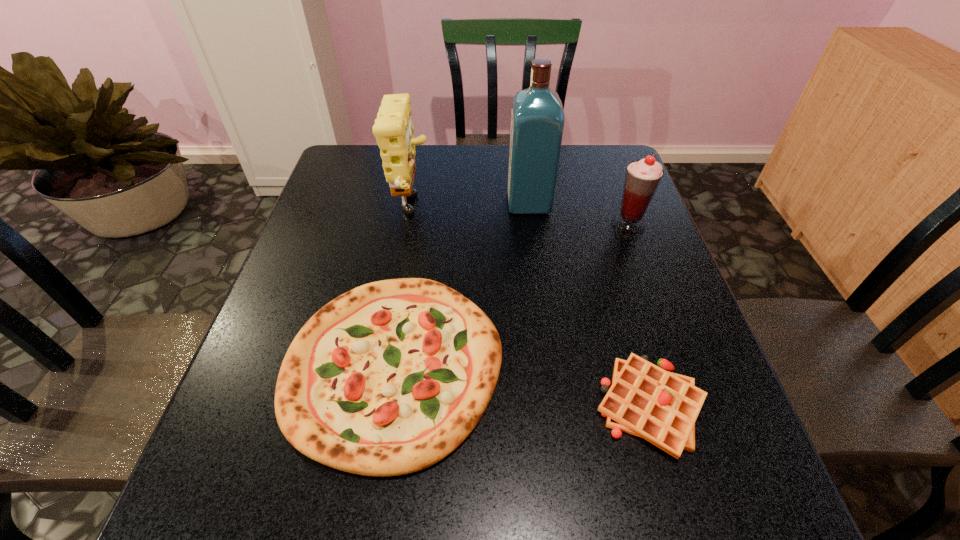
Locate an element on the screen. vacant space located 0.330m on the front of the third shortest object is located at coordinates point(671,341).

The image size is (960, 540). I want to click on vacant space located 0.060m on the left of the pizza, so click(x=256, y=364).

Find the location of a particular element. This screenshot has width=960, height=540. free space located 0.210m on the back of the waffle is located at coordinates point(613,283).

Where is `object located at the far edge`? This screenshot has height=540, width=960. object located at the far edge is located at coordinates [394, 131].

Image resolution: width=960 pixels, height=540 pixels. I want to click on object that is at the near edge, so click(389, 378).

The height and width of the screenshot is (540, 960). What are the coordinates of `object that is at the left edge` in the screenshot? It's located at (389, 378).

Image resolution: width=960 pixels, height=540 pixels. What are the coordinates of `smoothie present at the right edge` in the screenshot? It's located at click(642, 177).

This screenshot has height=540, width=960. What are the coordinates of `waffle that is at the right edge` in the screenshot? It's located at (644, 400).

This screenshot has height=540, width=960. I want to click on object that is at the near left corner, so click(389, 378).

This screenshot has width=960, height=540. Find the location of `vacant region at the far edge of the desktop`. vacant region at the far edge of the desktop is located at coordinates (557, 180).